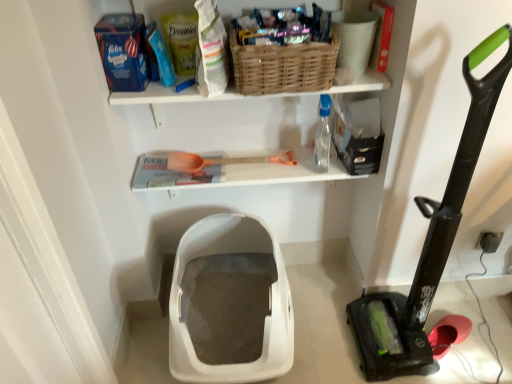
Question: Looking at their shapes, would you say transparent plastic bottle at upper right is wider or thinner than orange plastic shovel at center?

Choices:
 (A) thin
 (B) wide

Answer: (B)

Question: From the image's perspective, is transparent plastic bottle at upper right above or below orange plastic shovel at center?

Choices:
 (A) below
 (B) above

Answer: (B)

Question: Which object is the farthest from the transparent plastic bottle at upper right?

Choices:
 (A) white plastic litter box at center, positioned as the first storage box in left-to-right order
 (B) orange plastic shovel at center
 (C) black matte storage box at upper right, the 2th storage box viewed from the left
 (D) black rubber vacuum at right
 (E) woven brown basket at upper center

Answer: (A)

Question: Estimate the real-world distances between objects in this image. Which object is farther from the woven brown basket at upper center?

Choices:
 (A) transparent plastic bottle at upper right
 (B) black matte storage box at upper right, the 2th storage box viewed from the left
 (C) orange plastic shovel at center
 (D) black rubber vacuum at right
 (E) white plastic litter box at center, which is the second storage box in right-to-left order

Answer: (E)